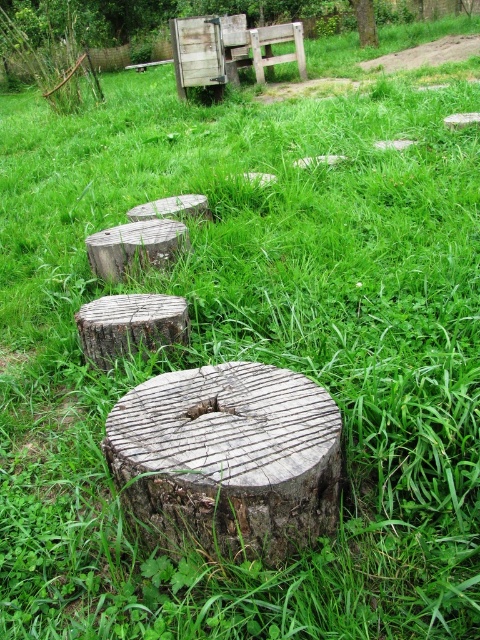
Question: Is rough bark stump at center above smooth brown tree trunk at upper center?

Choices:
 (A) no
 (B) yes

Answer: (A)

Question: Which object is closer to the camera taking this photo?

Choices:
 (A) smooth brown tree trunk at upper center
 (B) rough wooden stump at center
 (C) rough bark stump at center

Answer: (C)

Question: Is rough textured wood stump at center below rough bark stump at center?

Choices:
 (A) yes
 (B) no

Answer: (A)

Question: Which point appears closest to the camera in this image?

Choices:
 (A) (338, 429)
 (B) (151, 320)

Answer: (A)

Question: Is rough bark stump at center to the left of smooth brown tree trunk at upper center from the viewer's perspective?

Choices:
 (A) no
 (B) yes

Answer: (B)

Question: Among these objects, which one is farthest from the camera?

Choices:
 (A) rough wooden stump at center
 (B) rough textured wood stump at center
 (C) rough bark stump at center
 (D) smooth brown tree trunk at upper center

Answer: (D)